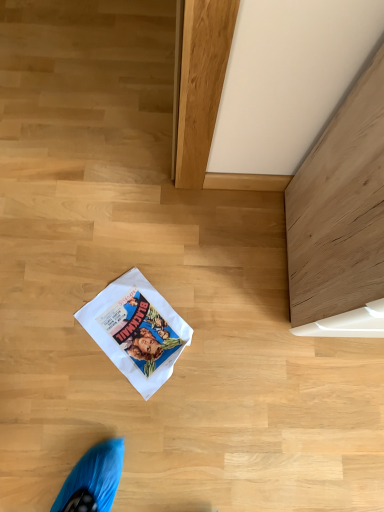
Identify the location of vacant point to the right of white paper comic book at center. (222, 350).